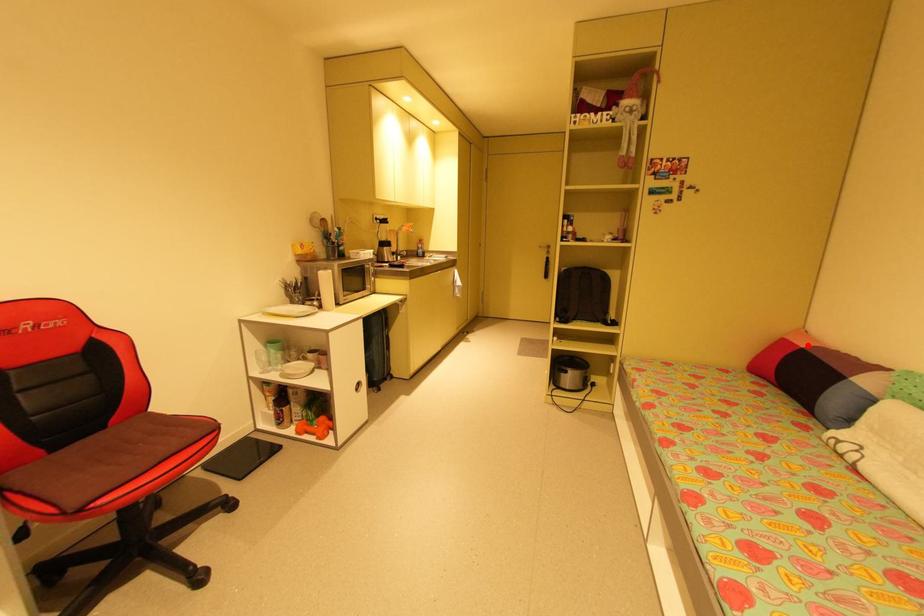
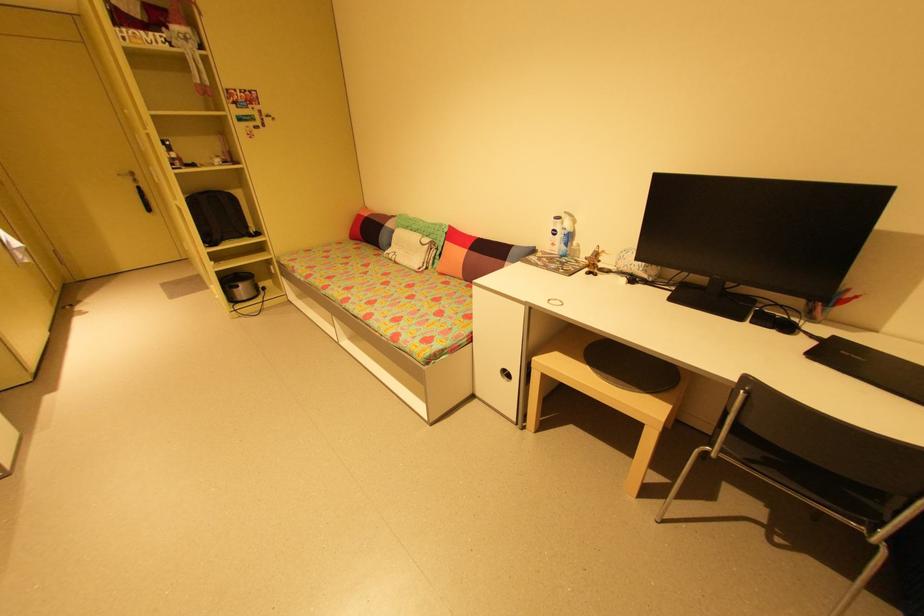
Find the pixel in the second image that matches the highlighted location in the first image.

(371, 215)